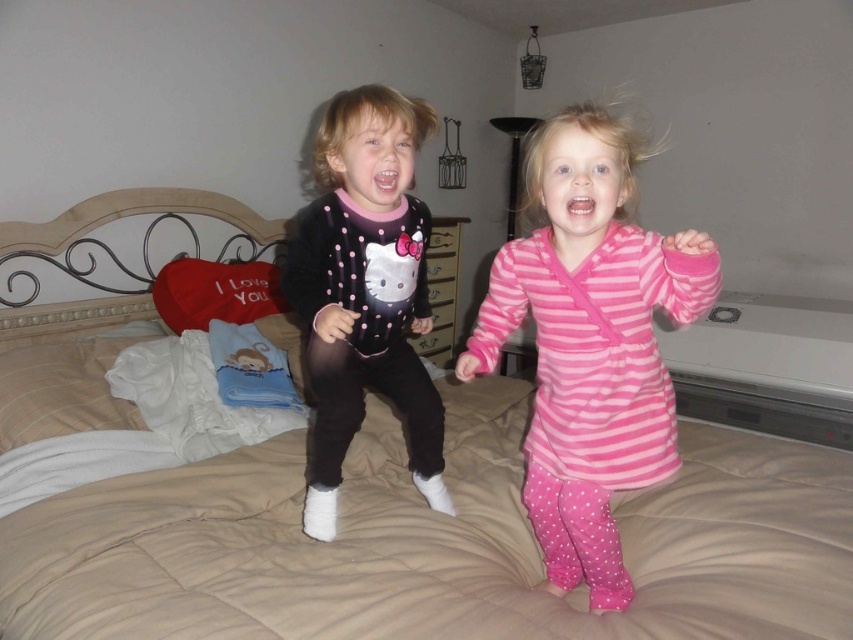
Is pink striped dress at center above matte black hello kitty onesie at center?

No.

Can you confirm if pink striped dress at center is shorter than matte black hello kitty onesie at center?

No.

Which is behind, point (693, 260) or point (309, 253)?

Point (309, 253)

Locate an element on the screen. The image size is (853, 640). pink striped dress at center is located at coordinates (590, 342).

Between point (225, 513) and point (386, 289), which one is positioned behind?

The point (225, 513) is more distant.

Does beige quilted bed at center have a smaller size compared to matte black hello kitty onesie at center?

No.

This screenshot has height=640, width=853. I want to click on beige quilted bed at center, so click(432, 544).

What are the coordinates of `beige quilted bed at center` in the screenshot? It's located at (432, 544).

Is beige quilted bed at center smaller than pink striped dress at center?

Actually, beige quilted bed at center might be larger than pink striped dress at center.

Does beige quilted bed at center lie in front of pink striped dress at center?

No, beige quilted bed at center is further to the viewer.

Image resolution: width=853 pixels, height=640 pixels. I want to click on beige quilted bed at center, so click(432, 544).

Where is `beige quilted bed at center`? beige quilted bed at center is located at coordinates (432, 544).